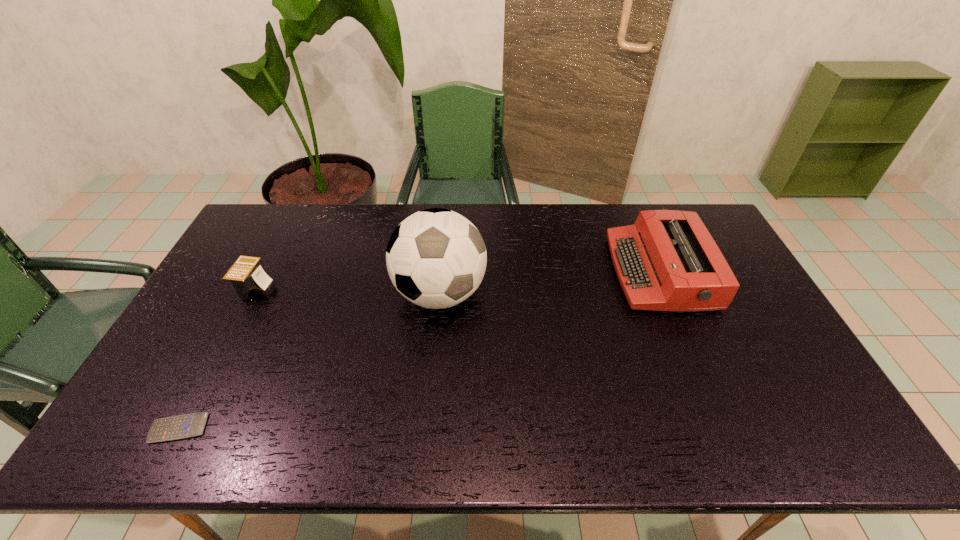
The width and height of the screenshot is (960, 540). What are the coordinates of `blank space at the near edge of the desktop` in the screenshot? It's located at (675, 452).

The image size is (960, 540). Find the location of `free space at the left edge of the desktop`. free space at the left edge of the desktop is located at coordinates (226, 301).

In the image, there is a desktop. At what (x,y) coordinates should I click in order to perform the action: click on vacant region at the right edge. Please return your answer as a coordinate pair (x, y). This screenshot has width=960, height=540. Looking at the image, I should click on (744, 312).

Find the location of a particular element. The width and height of the screenshot is (960, 540). free region at the far right corner of the desktop is located at coordinates (723, 241).

In order to click on blank space at the near right corner in this screenshot , I will do `click(795, 448)`.

Where is `vacant area that lies between the third tallest object and the nearest object`? This screenshot has width=960, height=540. vacant area that lies between the third tallest object and the nearest object is located at coordinates (218, 359).

You are a GUI agent. You are given a task and a screenshot of the screen. Output one action in this format:
    pyautogui.click(x=<x>, y=<y>)
    Task: Click on the vacant region between the second tallest object and the nearest object
    The width and height of the screenshot is (960, 540).
    Given the screenshot: What is the action you would take?
    pyautogui.click(x=420, y=350)

Locate an element on the screen. free space that is in between the farther calculator and the soccer ball is located at coordinates (348, 292).

You are a GUI agent. You are given a task and a screenshot of the screen. Output one action in this format:
    pyautogui.click(x=<x>, y=<y>)
    Task: Click on the free space between the second tallest object and the third object from left to right
    Image resolution: width=960 pixels, height=540 pixels.
    Given the screenshot: What is the action you would take?
    pyautogui.click(x=549, y=283)

Where is `blank region between the nearer calculator and the third shortest object`? The width and height of the screenshot is (960, 540). blank region between the nearer calculator and the third shortest object is located at coordinates (420, 350).